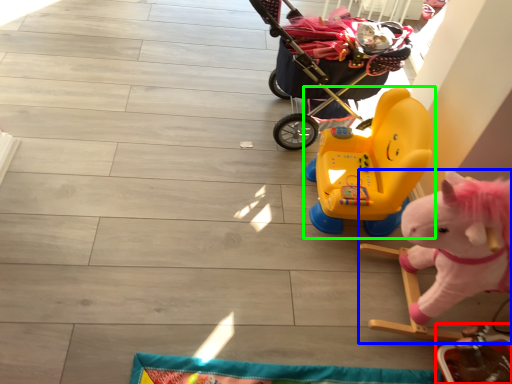
Question: Based on their relative distances, which object is nearer to toy (highlighted by a red box)? Choose from toy (highlighted by a blue box) and toy (highlighted by a green box).

Choices:
 (A) toy
 (B) toy

Answer: (A)